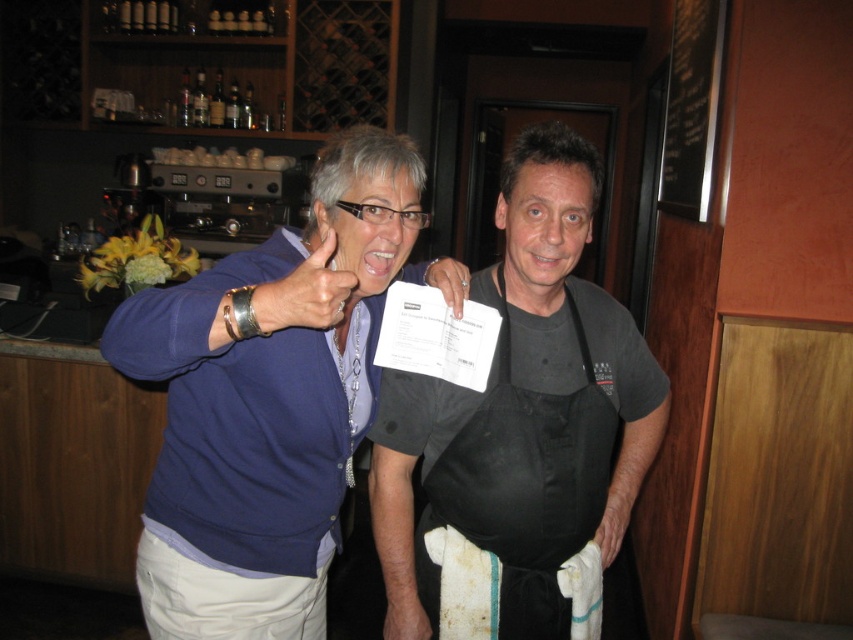
You are a barista trying to place a new menu card on the counter. The menu card is 10 cm wide. You see the smooth skin hand at center and the matte black apron at center. Can the menu card fit between them?

The smooth skin hand at center is wider than the matte black apron at center. Since the menu card is 10 cm wide, it depends on the actual width of the space between them. However, the description only states the hand is wider than the apron, but not the exact dimensions. Without knowing the exact width of the space between them, it is impossible to determine if the menu card will fit.

You are a customer at the cafe and want to point out an item to the staff member. Which item is higher up, the matte gold ring at upper center or the white matte towel at lower center?

The matte gold ring at upper center is located above the white matte towel at lower center, so it is higher up.

You are a customer in a cafe and you see a smooth skin hand at center and a matte black apron at center. Which one is closer to you?

The smooth skin hand at center is closer to you because it is further to the viewer than the matte black apron at center.